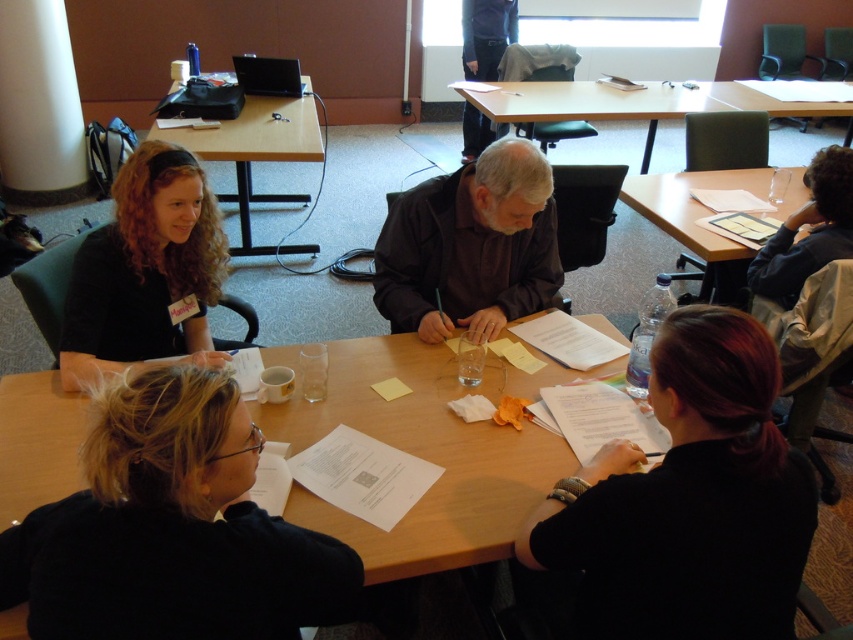
Question: Which object is positioned farthest from the blonde hair at center?

Choices:
 (A) clear plastic water bottle at right
 (B) dark brown shirt at center
 (C) black fabric shirt at lower right
 (D) curly hair at center

Answer: (A)

Question: Is blonde hair at center positioned behind dark brown shirt at center?

Choices:
 (A) yes
 (B) no

Answer: (B)

Question: Is black fabric shirt at lower right positioned in front of wooden table at center?

Choices:
 (A) no
 (B) yes

Answer: (B)

Question: Among these objects, which one is nearest to the camera?

Choices:
 (A) blonde hair at center
 (B) curly hair at center
 (C) clear plastic water bottle at right
 (D) dark gray shirt at upper center

Answer: (A)

Question: Which point is closer to the camera?

Choices:
 (A) (126, 168)
 (B) (477, 202)
 (C) (309, 147)

Answer: (A)

Question: Does dark brown shirt at center appear over clear plastic water bottle at right?

Choices:
 (A) yes
 (B) no

Answer: (B)